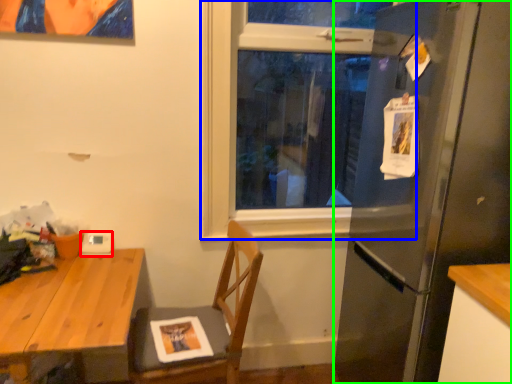
Question: Which object is positioned farthest from appliance (highlighted by a red box)? Select from window (highlighted by a blue box) and refrigerator (highlighted by a green box).

Choices:
 (A) window
 (B) refrigerator

Answer: (B)